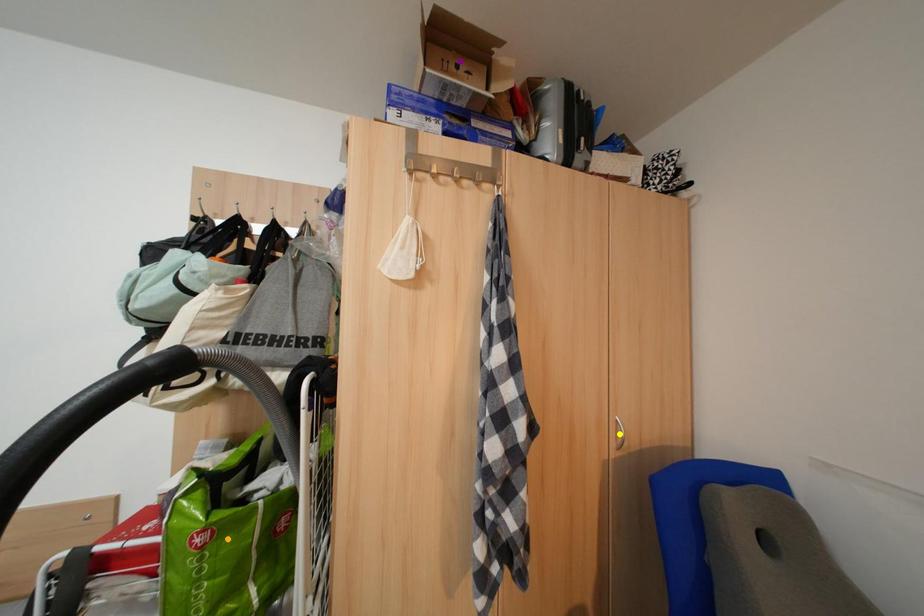
Order these from nearest to farthest:
- orange point
- yellow point
- purple point

orange point → purple point → yellow point